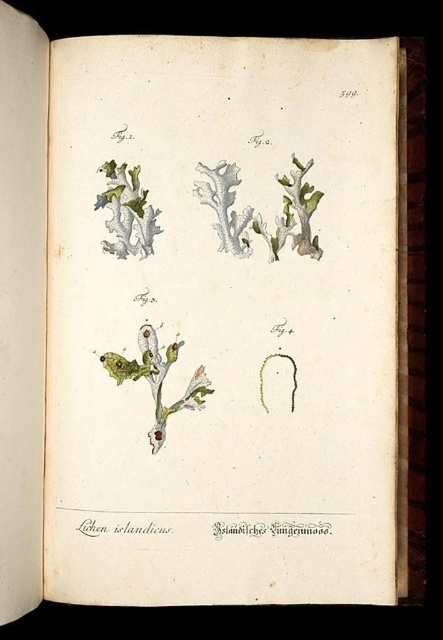
Is greenish-white lichen at upper left smaller than green matte lichen at center?

Actually, greenish-white lichen at upper left might be larger than green matte lichen at center.

Does greenish-white lichen at upper left have a lesser height compared to green matte lichen at center?

No, greenish-white lichen at upper left is not shorter than green matte lichen at center.

Who is more distant from viewer, (265,240) or (197,406)?

Point (265,240)

Image resolution: width=443 pixels, height=640 pixels. Find the location of `greenish-white lichen at upper left`. greenish-white lichen at upper left is located at coordinates (259, 212).